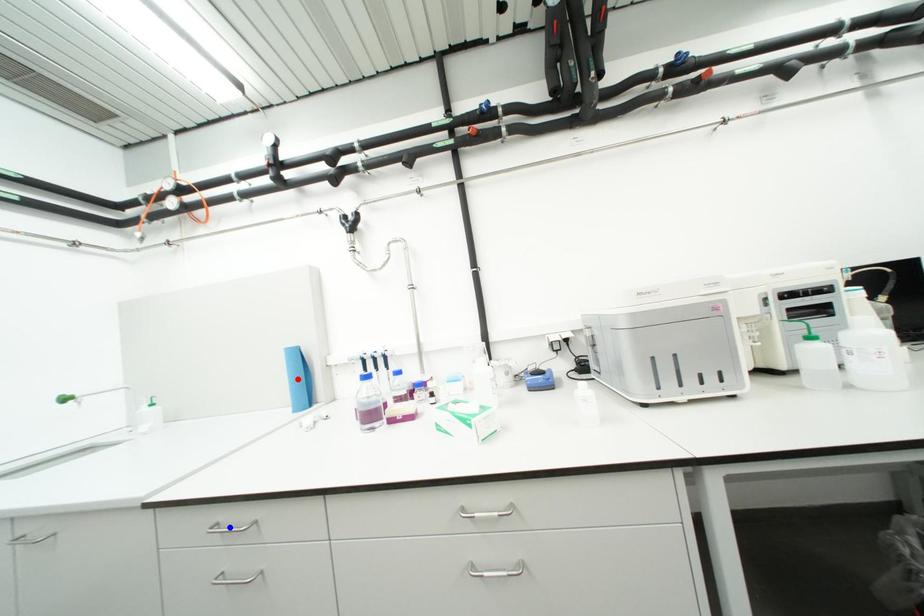
Question: In the image, two points are highlighted. Which point is nearer to the camera? Reply with the corresponding letter.

Choices:
 (A) blue point
 (B) red point

Answer: (A)